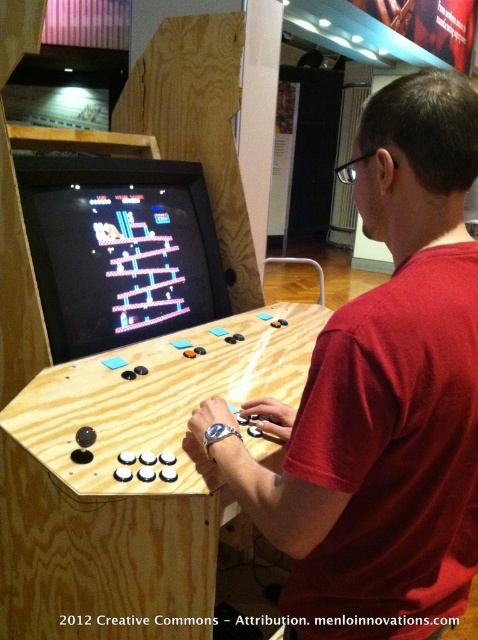
Question: Is matte wood man at center behind wooden arcade cabinet at center?

Choices:
 (A) yes
 (B) no

Answer: (B)

Question: Can you confirm if matte wood man at center is wider than wooden arcade cabinet at center?

Choices:
 (A) no
 (B) yes

Answer: (A)

Question: Is matte wood man at center positioned before wooden arcade cabinet at center?

Choices:
 (A) no
 (B) yes

Answer: (B)